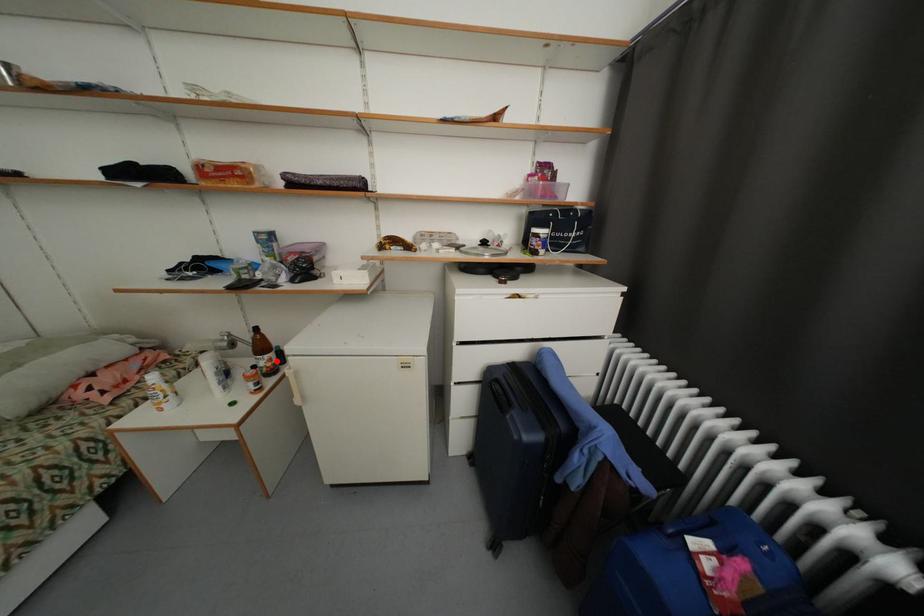
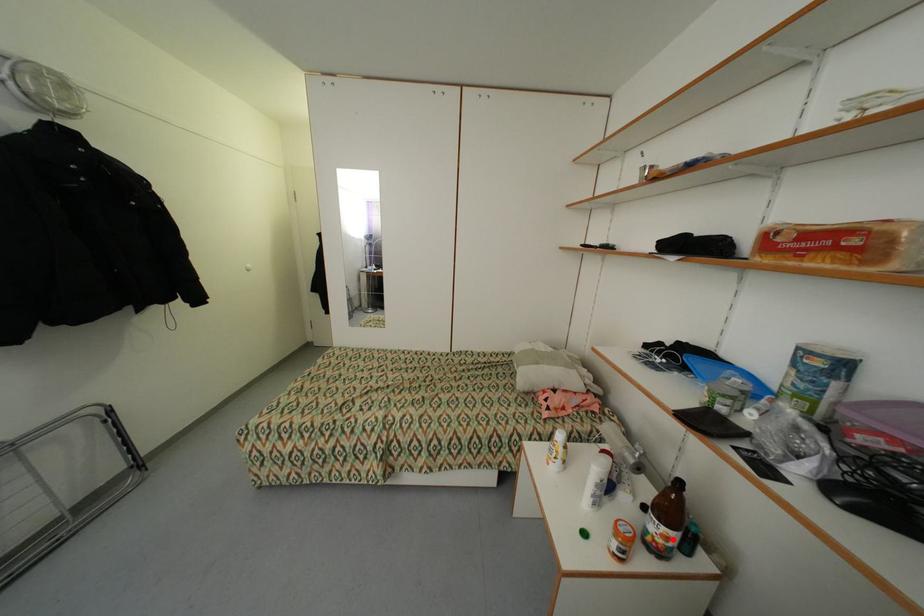
I am providing you with two images of the same scene from different viewpoints. A red point is marked on the first image and another point is marked on the second image. Does the point marked in image1 correspond to the same location as the one in image2?

Yes